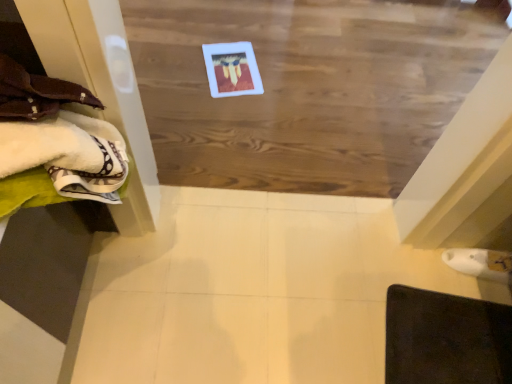
Question: From the image's perspective, is dark brown leather mat at lower right located above white soft towels at left?

Choices:
 (A) yes
 (B) no

Answer: (B)

Question: Considering the relative sizes of dark brown leather mat at lower right and white soft towels at left in the image provided, is dark brown leather mat at lower right smaller than white soft towels at left?

Choices:
 (A) yes
 (B) no

Answer: (A)

Question: Does dark brown leather mat at lower right have a lesser height compared to white soft towels at left?

Choices:
 (A) no
 (B) yes

Answer: (B)

Question: From a real-world perspective, is dark brown leather mat at lower right located beneath white soft towels at left?

Choices:
 (A) no
 (B) yes

Answer: (B)

Question: Is dark brown leather mat at lower right oriented away from white soft towels at left?

Choices:
 (A) no
 (B) yes

Answer: (A)

Question: Is point (470, 350) positioned closer to the camera than point (204, 14)?

Choices:
 (A) closer
 (B) farther

Answer: (A)

Question: Considering the positions of dark brown leather mat at lower right and wooden board at center in the image, is dark brown leather mat at lower right taller or shorter than wooden board at center?

Choices:
 (A) tall
 (B) short

Answer: (B)

Question: Is dark brown leather mat at lower right to the left or to the right of wooden board at center in the image?

Choices:
 (A) right
 (B) left

Answer: (A)

Question: Is dark brown leather mat at lower right inside or outside of wooden board at center?

Choices:
 (A) inside
 (B) outside

Answer: (B)

Question: In terms of size, does white soft towels at left appear bigger or smaller than dark brown leather mat at lower right?

Choices:
 (A) big
 (B) small

Answer: (A)

Question: Is white soft towels at left taller or shorter than dark brown leather mat at lower right?

Choices:
 (A) tall
 (B) short

Answer: (A)

Question: Is white soft towels at left in front of or behind dark brown leather mat at lower right in the image?

Choices:
 (A) behind
 (B) front

Answer: (B)

Question: Is point (4, 124) closer or farther from the camera than point (504, 324)?

Choices:
 (A) farther
 (B) closer

Answer: (B)

Question: In terms of height, does wooden board at center look taller or shorter compared to dark brown leather mat at lower right?

Choices:
 (A) short
 (B) tall

Answer: (B)

Question: Does point (169, 77) appear closer or farther from the camera than point (460, 360)?

Choices:
 (A) closer
 (B) farther

Answer: (B)